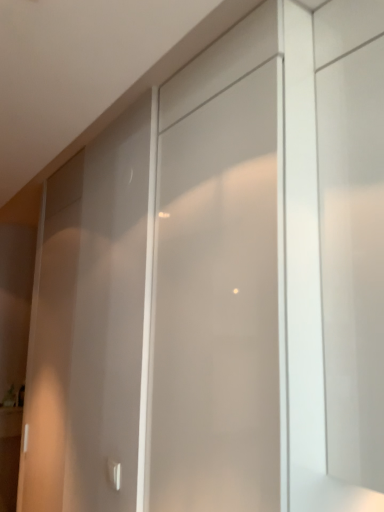
Question: Is point (274, 377) positioned closer to the camera than point (119, 482)?

Choices:
 (A) closer
 (B) farther

Answer: (A)

Question: From the image's perspective, is frosted glass screen door at center located above or below white glossy door handle at lower left?

Choices:
 (A) above
 (B) below

Answer: (A)

Question: Choose the correct answer: Is frosted glass screen door at center inside white glossy door handle at lower left or outside it?

Choices:
 (A) inside
 (B) outside

Answer: (B)

Question: Considering the positions of white glossy door handle at lower left and frosted glass screen door at center in the image, is white glossy door handle at lower left taller or shorter than frosted glass screen door at center?

Choices:
 (A) short
 (B) tall

Answer: (A)

Question: Considering their positions, is white glossy door handle at lower left located in front of or behind frosted glass screen door at center?

Choices:
 (A) behind
 (B) front

Answer: (A)

Question: Do you think white glossy door handle at lower left is within frosted glass screen door at center, or outside of it?

Choices:
 (A) outside
 (B) inside

Answer: (A)

Question: Is point (119, 480) positioned closer to the camera than point (269, 126)?

Choices:
 (A) farther
 (B) closer

Answer: (A)